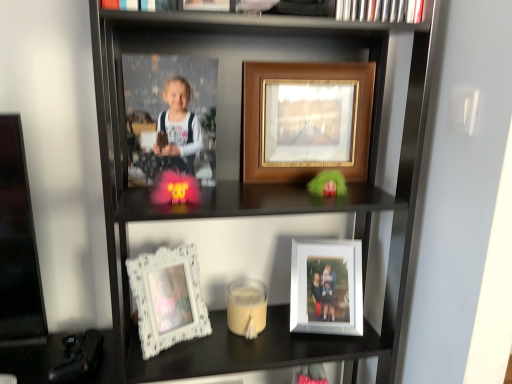
Question: Considering the positions of wooden framed photo at center, marked as the third picture frame in a bottom-to-top arrangement, and white ornate frame at lower left, which is the first picture frame from bottom to top, in the image, is wooden framed photo at center, marked as the third picture frame in a bottom-to-top arrangement, wider or thinner than white ornate frame at lower left, which is the first picture frame from bottom to top,?

Choices:
 (A) thin
 (B) wide

Answer: (A)

Question: Considering the positions of wooden framed photo at center, the 2th picture frame when ordered from right to left, and white ornate frame at lower left, which is the first picture frame from bottom to top, in the image, is wooden framed photo at center, the 2th picture frame when ordered from right to left, bigger or smaller than white ornate frame at lower left, which is the first picture frame from bottom to top,?

Choices:
 (A) big
 (B) small

Answer: (A)

Question: Which is nearer to the white glossy photo frame at lower center, positioned as the second picture frame in top-to-bottom order?

Choices:
 (A) wooden framed picture at upper center
 (B) fuzzy pink toy at center
 (C) wooden framed photo at center, placed as the 1th picture frame when sorted from top to bottom
 (D) matte black book at upper center
 (E) white matte candle at center

Answer: (E)

Question: Which object is the closest to the white matte candle at center?

Choices:
 (A) white ornate frame at lower left, which is the 3th picture frame from top to bottom
 (B) white glossy photo frame at lower center, positioned as the first picture frame in right-to-left order
 (C) matte black book at upper center
 (D) wooden framed picture at upper center
 (E) fuzzy pink toy at center

Answer: (A)